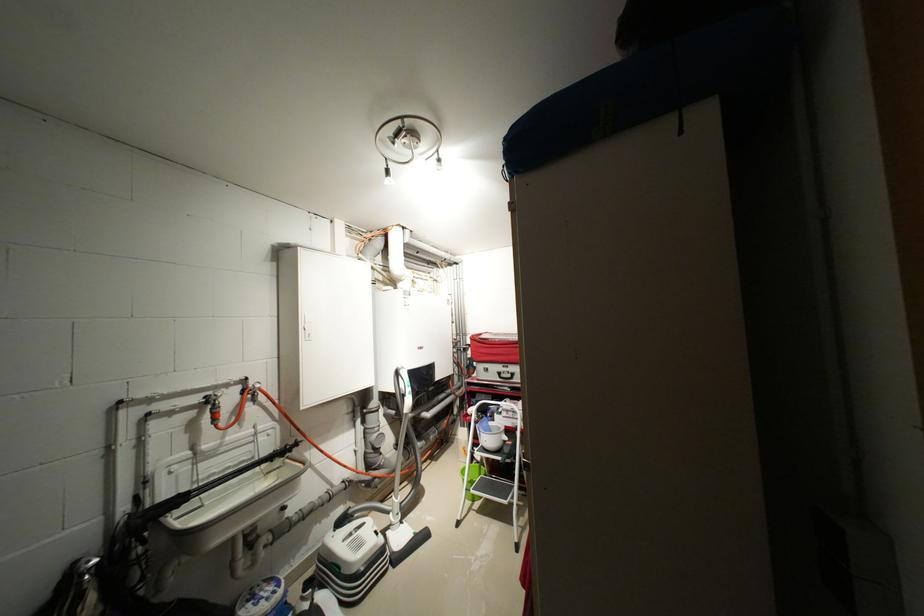
What do you see at coordinates (464, 341) in the screenshot? I see `the red suitcase handle` at bounding box center [464, 341].